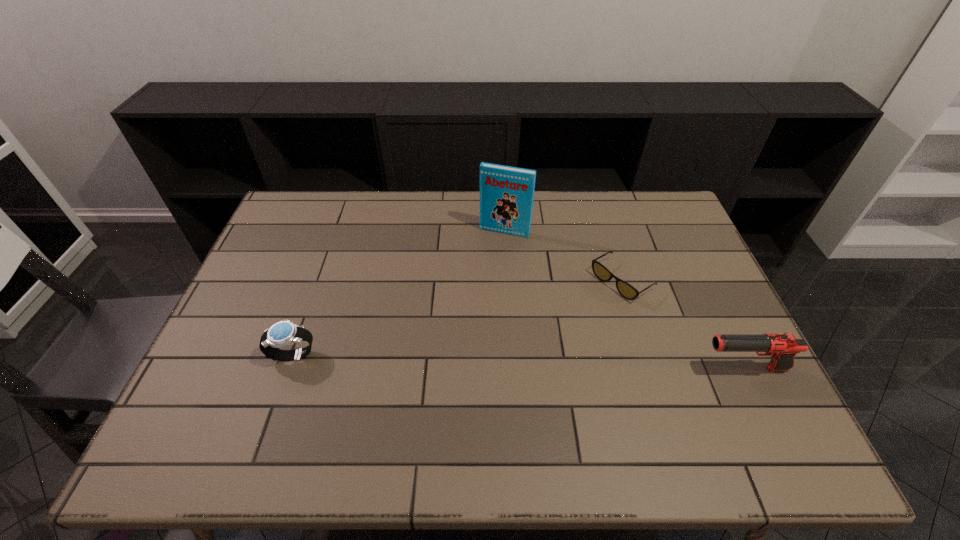
Where is `blank area located 0.270m at the aiming end of the second tallest object`? blank area located 0.270m at the aiming end of the second tallest object is located at coordinates (592, 369).

Where is `vacant space located at the aiming end of the second tallest object`? vacant space located at the aiming end of the second tallest object is located at coordinates (652, 369).

The width and height of the screenshot is (960, 540). I want to click on vacant space situated 0.090m on the front cover of the book, so click(x=491, y=256).

Find the location of a particular element. The image size is (960, 540). vacant area situated on the front cover of the book is located at coordinates (468, 315).

This screenshot has width=960, height=540. Identify the location of free space located 0.160m on the front cover of the book. (485, 271).

The height and width of the screenshot is (540, 960). In order to click on free space located 0.150m on the front-facing side of the second farthest object in this screenshot , I will do `click(565, 321)`.

At what (x,y) coordinates should I click in order to perform the action: click on vacant area located 0.090m on the front-facing side of the second farthest object. Please return your answer as a coordinate pair (x, y). This screenshot has height=540, width=960. Looking at the image, I should click on (581, 310).

What are the coordinates of `vacant position located on the front-facing side of the second farthest object` in the screenshot? It's located at (583, 309).

Find the location of `object that is at the far edge`. object that is at the far edge is located at coordinates (506, 193).

Find the location of `object that is at the left edge`. object that is at the left edge is located at coordinates (283, 333).